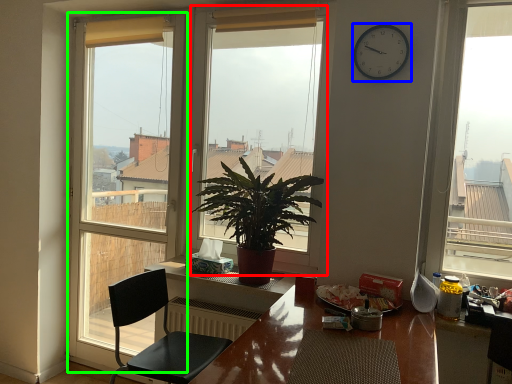
Question: Which object is the farthest from window (highlighted by a red box)? Choose among these: clock (highlighted by a blue box) or window (highlighted by a green box).

Choices:
 (A) clock
 (B) window

Answer: (A)